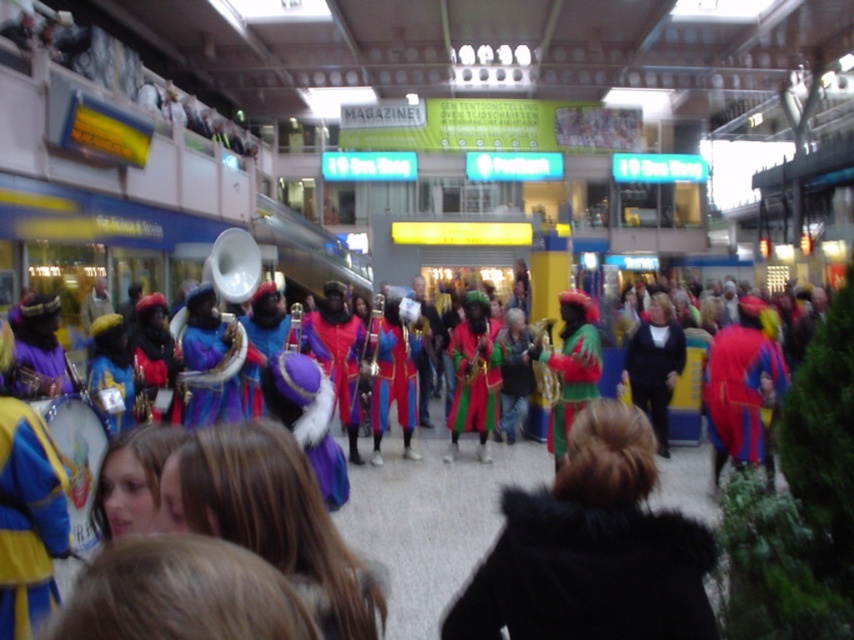
You are standing at the origin point of the coordinate system in the shopping mall. The multicolored costume at center is located at point 0.820, 0.505. If you want to walk directly towards it, which direction should you move in? Please provide the direction as a coordinate direction vector.

The direction vector to move towards the multicolored costume at center would be the vector pointing from the origin to its coordinates, which is simply the vector <(430, 524)>.